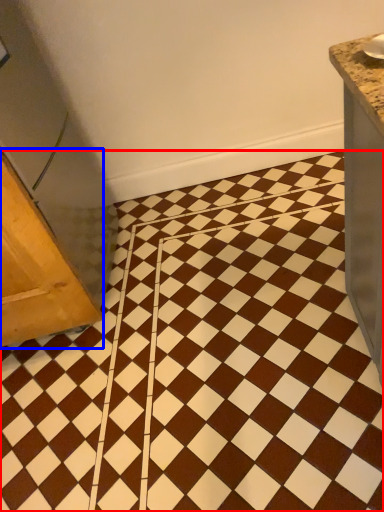
Question: Which object appears farthest to the camera in this image, ceramic tile (highlighted by a red box) or furniture (highlighted by a blue box)?

Choices:
 (A) ceramic tile
 (B) furniture

Answer: (B)